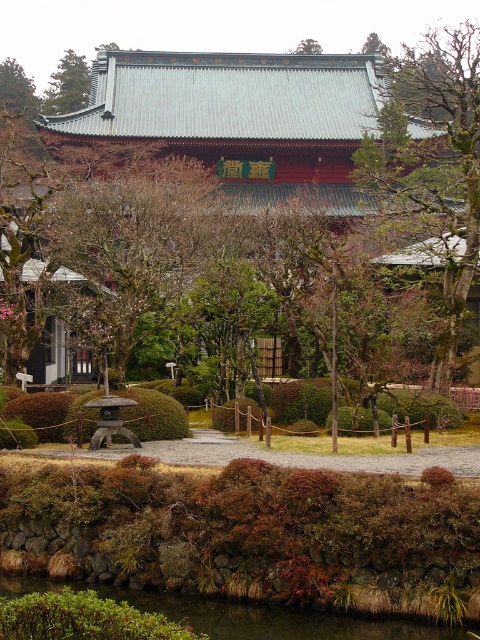
Question: Considering the relative positions of bare branches at upper right and green grassy water at lower left in the image provided, where is bare branches at upper right located with respect to green grassy water at lower left?

Choices:
 (A) above
 (B) below

Answer: (A)

Question: Which object is positioned closest to the green leafy tree at upper left?

Choices:
 (A) bare branches at upper right
 (B) green grassy water at lower left

Answer: (A)

Question: Is bare branches at upper right further to camera compared to green leafy tree at upper left?

Choices:
 (A) no
 (B) yes

Answer: (A)

Question: Which object appears farthest from the camera in this image?

Choices:
 (A) bare branches at upper right
 (B) green leafy tree at upper left
 (C) green grassy water at lower left
 (D) brown wood tree at upper left

Answer: (B)

Question: Which point is closer to the camera?

Choices:
 (A) bare branches at upper right
 (B) green grassy water at lower left
 (C) brown wood tree at upper left

Answer: (B)

Question: Can you confirm if green grassy water at lower left is wider than brown wood tree at upper left?

Choices:
 (A) yes
 (B) no

Answer: (B)